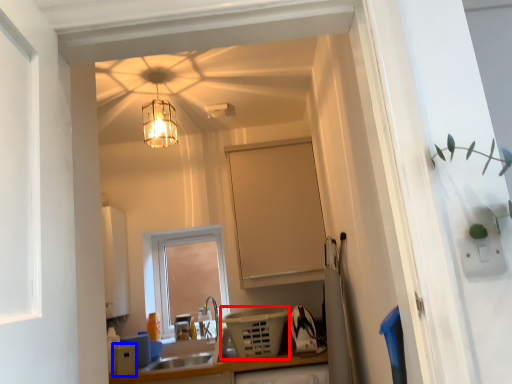
Question: Which point is closer to the camera, appliance (highlighted by a red box) or appliance (highlighted by a blue box)?

Choices:
 (A) appliance
 (B) appliance

Answer: (A)